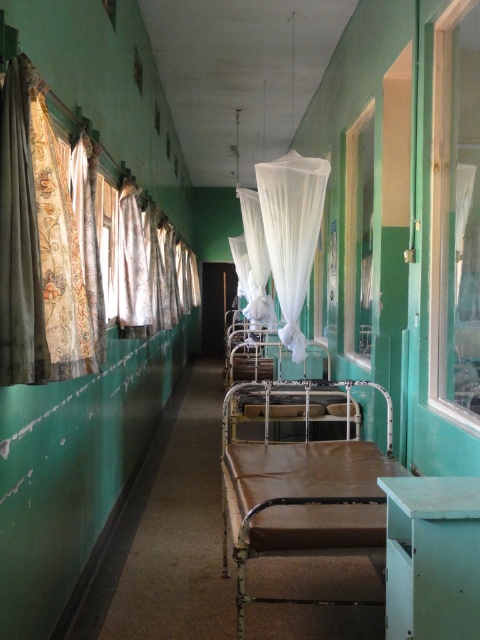
Question: Which point appears closest to the camera in this image?

Choices:
 (A) (363, 275)
 (B) (469, 273)
 (C) (335, 522)
 (D) (25, 97)

Answer: (D)

Question: Which point is farther from the camera taking this photo?

Choices:
 (A) (51, 160)
 (B) (445, 90)
 (C) (21, 136)

Answer: (B)

Question: Estimate the real-world distances between objects in this image. Which object is farther from the clear glass door at right?

Choices:
 (A) white sheer curtain at center
 (B) patterned fabric curtain at left
 (C) textured beige curtain at left

Answer: (C)

Question: Can you confirm if brown leather bed at center is thinner than white sheer curtain at center?

Choices:
 (A) yes
 (B) no

Answer: (B)

Question: Can you confirm if brown leather bed at center is positioned below white sheer curtain at center?

Choices:
 (A) no
 (B) yes

Answer: (B)

Question: Is brown leather bed at center wider than clear glass window at center?

Choices:
 (A) yes
 (B) no

Answer: (A)